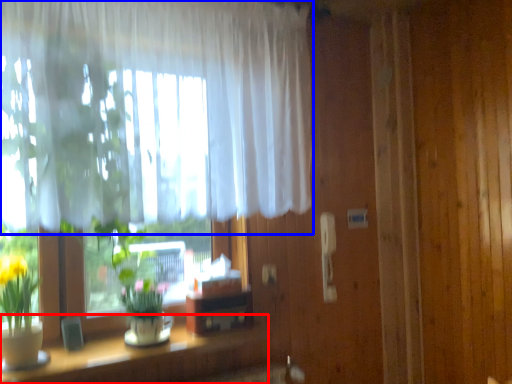
Question: Which object is closer to the camera taking this photo, table (highlighted by a red box) or curtain (highlighted by a blue box)?

Choices:
 (A) table
 (B) curtain

Answer: (B)